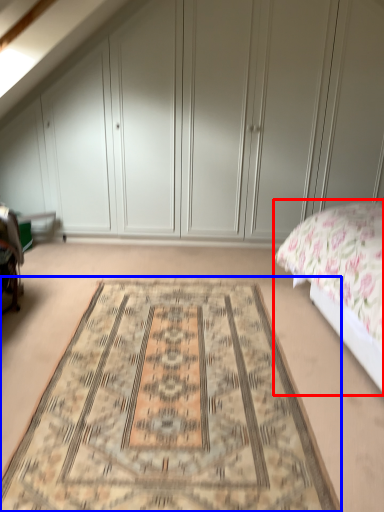
Question: Which object appears farthest to the camera in this image, bed (highlighted by a red box) or mat (highlighted by a blue box)?

Choices:
 (A) bed
 (B) mat

Answer: (B)